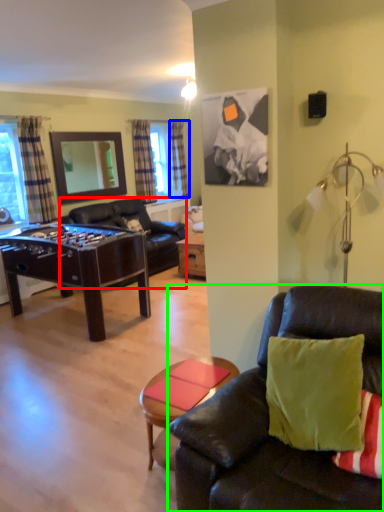
Question: Which is nearer to the studio couch (highlighted by a red box)? curtain (highlighted by a blue box) or studio couch (highlighted by a green box).

Choices:
 (A) curtain
 (B) studio couch

Answer: (A)